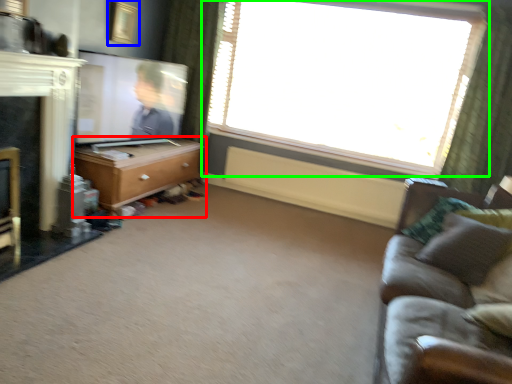
Question: Which object is the farthest from chest of drawers (highlighted by a red box)? Choose among these: picture frame (highlighted by a blue box) or window (highlighted by a green box).

Choices:
 (A) picture frame
 (B) window

Answer: (B)